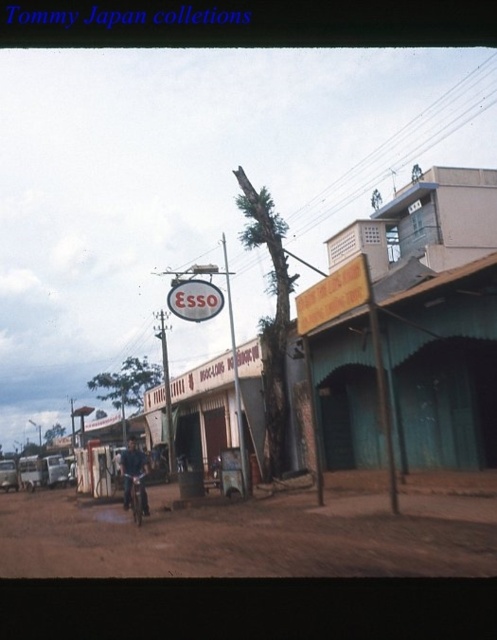
Does matte gray building at center appear on the left side of brown dirt track at center?

Yes, matte gray building at center is to the left of brown dirt track at center.

Is matte gray building at center smaller than brown dirt track at center?

No, matte gray building at center is not smaller than brown dirt track at center.

In order to click on matte gray building at center in this screenshot , I will do `click(403, 333)`.

Where is `matte gray building at center`? The width and height of the screenshot is (497, 640). matte gray building at center is located at coordinates (403, 333).

Which of these two, brown dirt track at center or dark blue fabric jacket at center, stands taller?

With more height is dark blue fabric jacket at center.

Is brown dirt track at center smaller than dark blue fabric jacket at center?

Indeed, brown dirt track at center has a smaller size compared to dark blue fabric jacket at center.

This screenshot has height=640, width=497. Describe the element at coordinates (248, 536) in the screenshot. I see `brown dirt track at center` at that location.

Image resolution: width=497 pixels, height=640 pixels. I want to click on brown dirt track at center, so click(248, 536).

Does brown dirt track at center have a greater width compared to smooth wooden pole at center?

Indeed, brown dirt track at center has a greater width compared to smooth wooden pole at center.

Is point (377, 529) positioned in front of point (248, 481)?

Yes, point (377, 529) is in front of point (248, 481).

Who is more forward, (494, 570) or (231, 340)?

Point (494, 570)

Identify the location of brown dirt track at center. This screenshot has width=497, height=640. (248, 536).